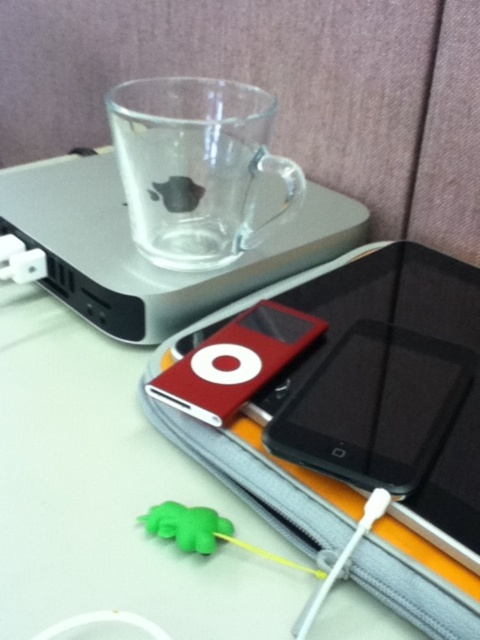
Question: Can you confirm if transparent plastic ipod at center is bigger than black glossy iphone at center?

Choices:
 (A) no
 (B) yes

Answer: (B)

Question: Does transparent plastic ipod at center lie behind transparent glass cup at upper center?

Choices:
 (A) yes
 (B) no

Answer: (A)

Question: From the image, what is the correct spatial relationship of transparent glass cup at upper center in relation to black glossy iphone at center?

Choices:
 (A) above
 (B) below

Answer: (A)

Question: Which point is closer to the camera?

Choices:
 (A) (152, 390)
 (B) (252, 196)

Answer: (A)

Question: Which point is closer to the camera?

Choices:
 (A) transparent plastic ipod at center
 (B) red matte/ipod at center
 (C) black glossy iphone at center

Answer: (C)

Question: Which point is farther to the camera?

Choices:
 (A) red matte/ipod at center
 (B) transparent glass cup at upper center
 (C) black glossy iphone at center
 (D) transparent plastic ipod at center

Answer: (D)